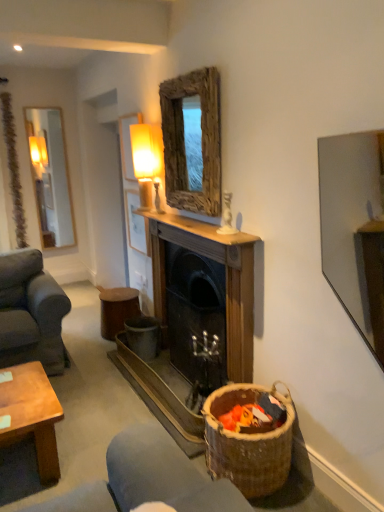
The image size is (384, 512). In order to click on vacant space underneath rustic wood mirror at upper center (from a real-world perspective) in this screenshot , I will do [x=185, y=217].